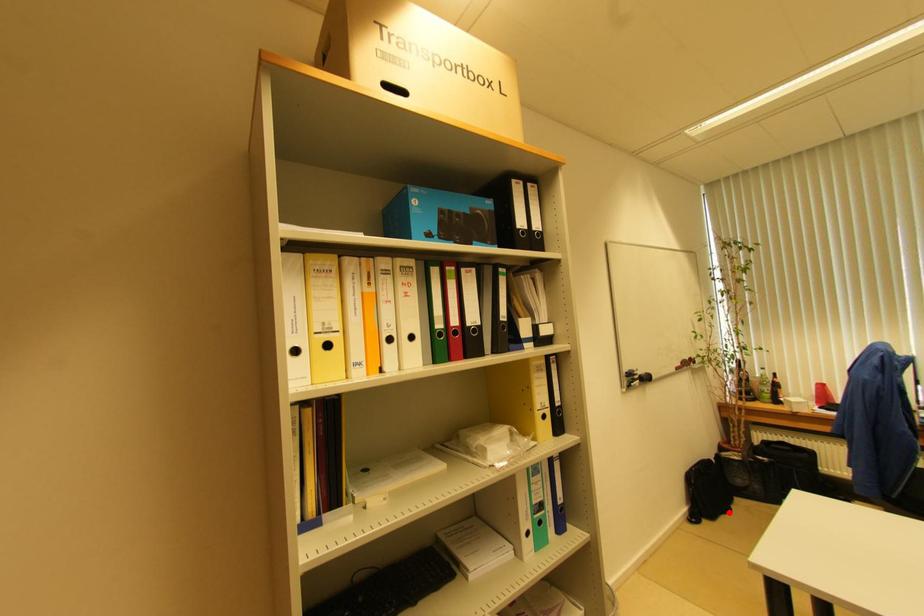
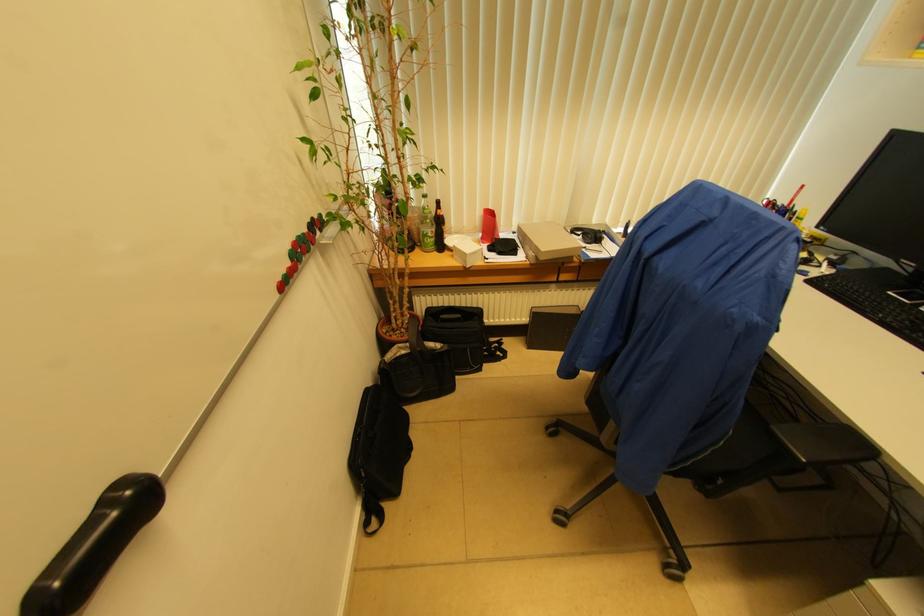
Question: I am providing you with two images of the same scene from different viewpoints. A red point is marked on the first image. At the location where the point appears in image 1, is it still visible in image 2?

Choices:
 (A) Yes
 (B) No

Answer: (A)